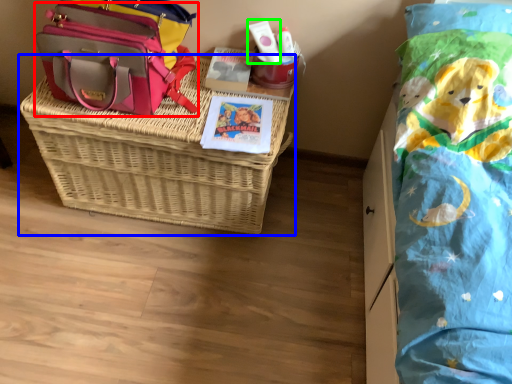
Question: Which object is the closest to the shoulder bag (highlighted by a red box)? Choose among these: picnic basket (highlighted by a blue box) or toiletry (highlighted by a green box).

Choices:
 (A) picnic basket
 (B) toiletry

Answer: (A)